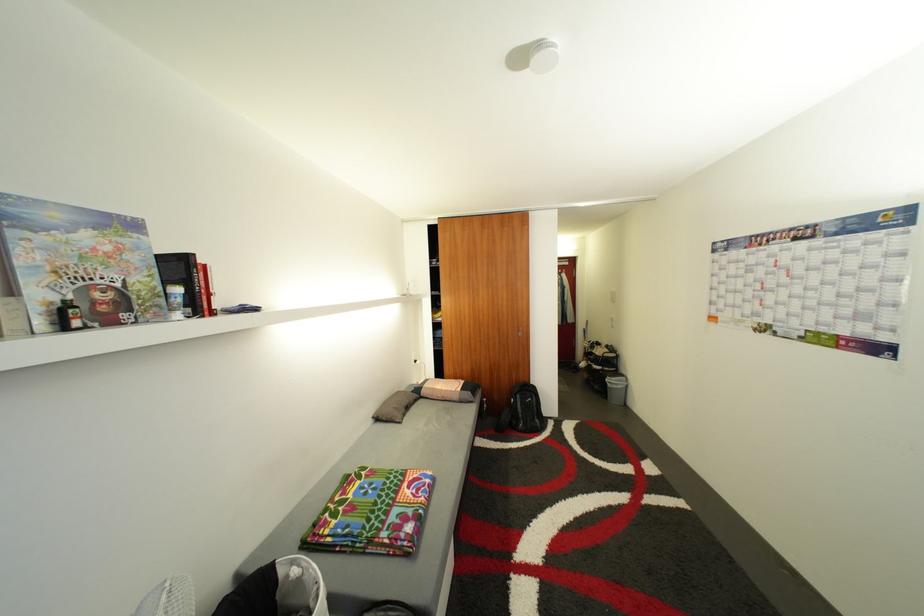
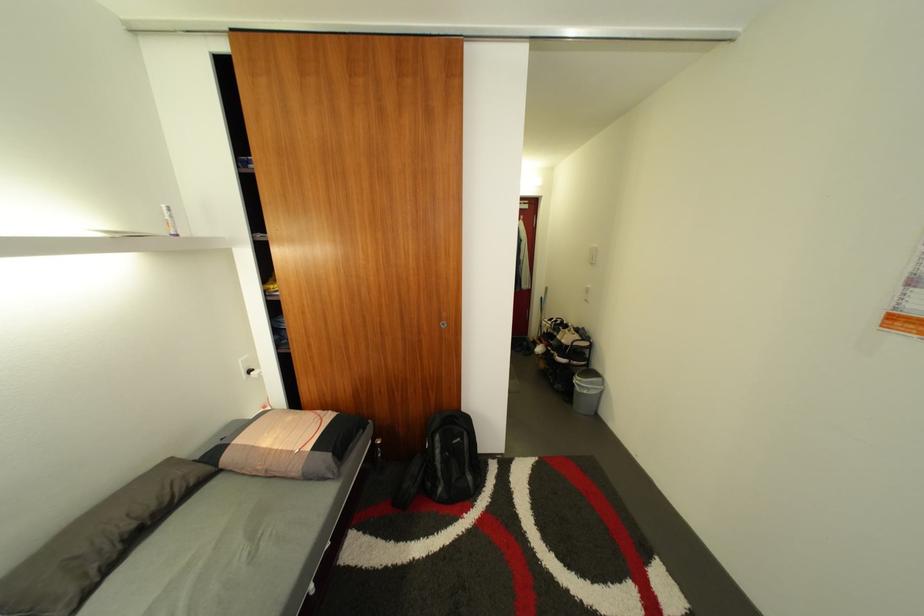
In a continuous first-person perspective shot, in which direction is the camera moving?

The movement direction of the cameraman is right, forward.